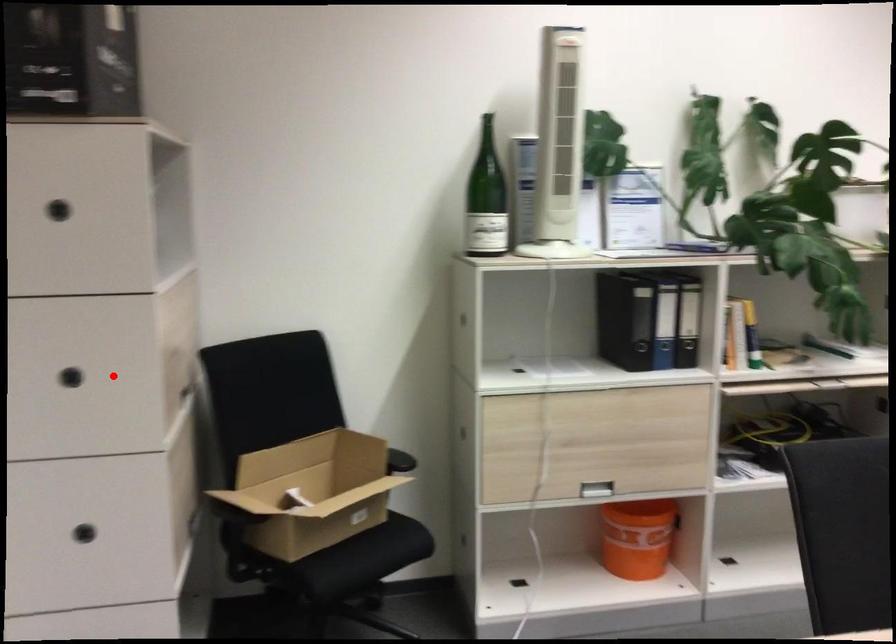
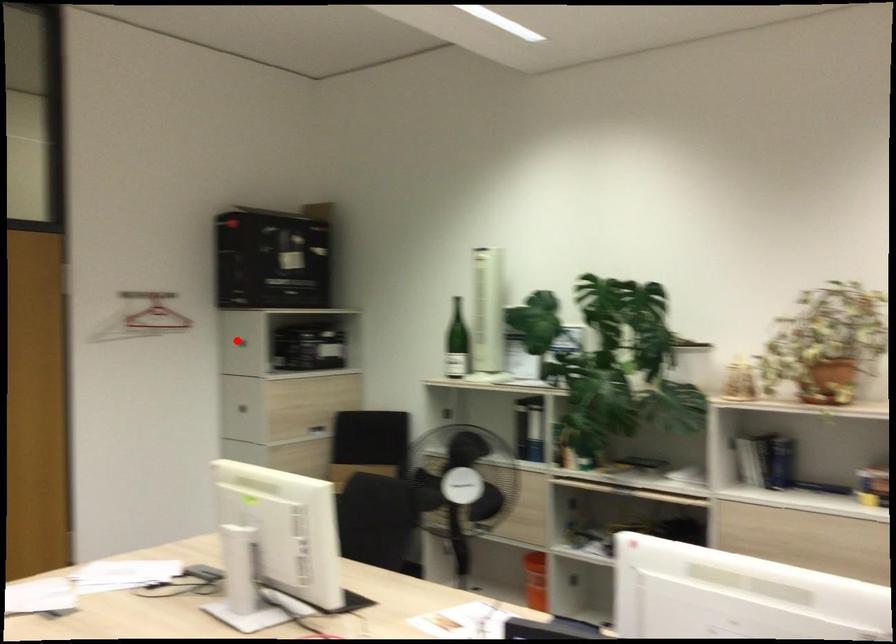
I am providing you with two images of the same scene from different viewpoints. A red point is marked on the first image and another point is marked on the second image. Does the point marked in image1 correspond to the same location as the one in image2?

No